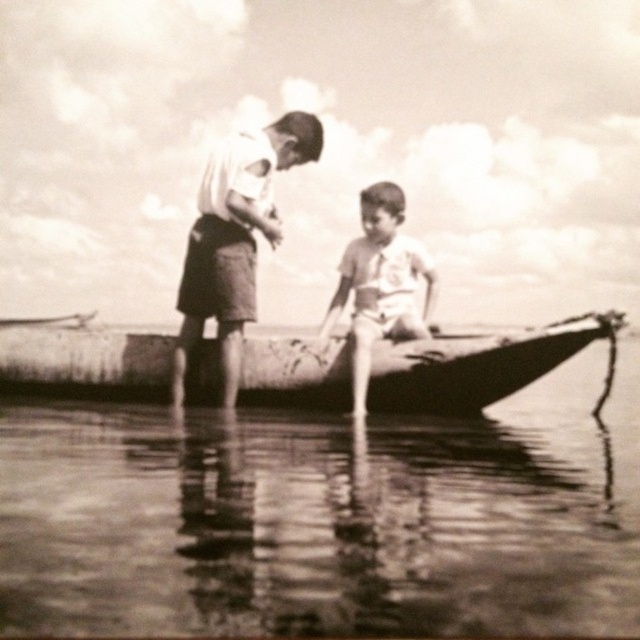
Based on the photo, can you confirm if smooth water at boat bottom is smaller than smooth wood canoe at center?

Incorrect, smooth water at boat bottom is not smaller in size than smooth wood canoe at center.

Between smooth water at boat bottom and smooth wood canoe at center, which one has less height?

smooth wood canoe at center

What do you see at coordinates (324, 516) in the screenshot? The image size is (640, 640). I see `smooth water at boat bottom` at bounding box center [324, 516].

Where is `smooth water at boat bottom`? The image size is (640, 640). smooth water at boat bottom is located at coordinates (324, 516).

Which is behind, point (449, 333) or point (355, 305)?

Point (355, 305)

Can you confirm if smooth wood canoe at center is thinner than striped cotton shirt at center?

Yes.

Describe the element at coordinates (476, 364) in the screenshot. I see `smooth wood canoe at center` at that location.

This screenshot has height=640, width=640. Identify the location of smooth wood canoe at center. (476, 364).

Can you confirm if smooth water at boat bottom is bigger than striped cotton shirt at center?

Yes, smooth water at boat bottom is bigger than striped cotton shirt at center.

Can you confirm if smooth water at boat bottom is shorter than striped cotton shirt at center?

Yes.

Is point (164, 534) more distant than point (380, 288)?

No.

The image size is (640, 640). Find the location of `smooth water at boat bottom`. smooth water at boat bottom is located at coordinates (324, 516).